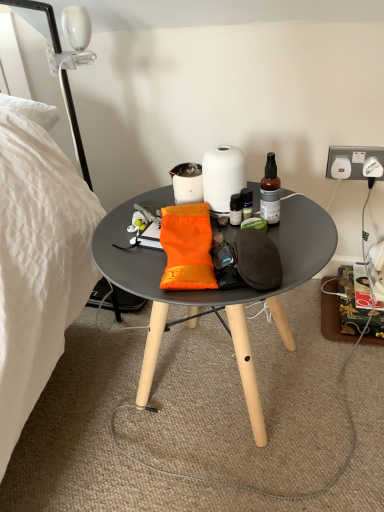
In order to click on empty space that is ontop of matte black table at center (from a real-world perspective) in this screenshot , I will do `click(201, 232)`.